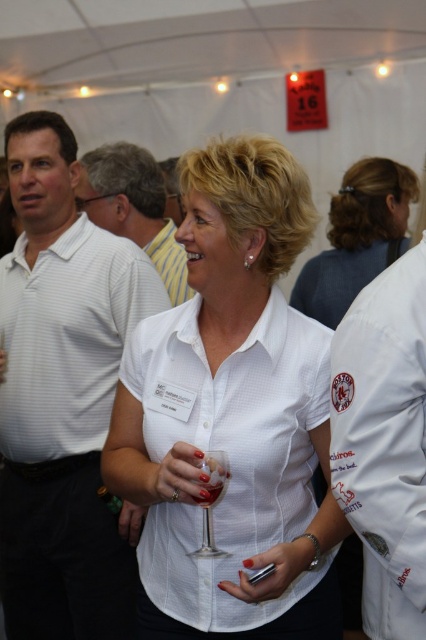
You are a photographer at the event and want to take a closeup shot of the woman in the foreground while ensuring the white striped polo shirt at left is still visible in the background. What should you do?

Since the white striped polo shirt at left is 2.05 meters away from the camera, you can adjust your camera settings to have a wide aperture to blur the background slightly while keeping the woman in focus. This allows the shirt to remain visible but not overpowering in the background.

You are at a social event and see two people wearing striped shirts. One is wearing a white striped polo shirt at left and the other a white striped shirt at upper left. Which one is positioned more to the left side of the image?

The white striped polo shirt at left is positioned more to the left side of the image compared to the white striped shirt at upper left.

In the scene shown: Please provide the coordinates of the white cotton shirt at center in the image.

The white cotton shirt at center is located at coordinates point (385,442).